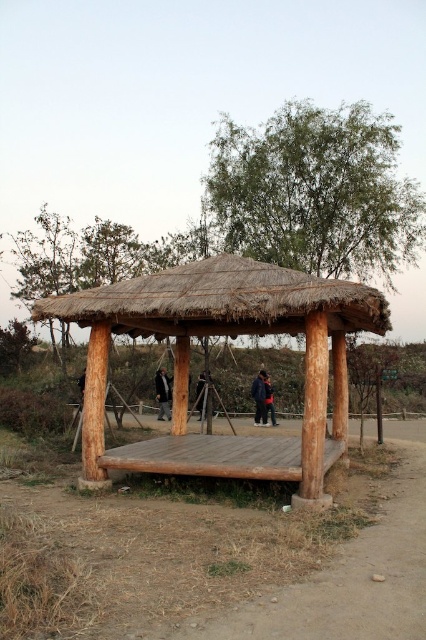
You are standing in the rustic wooden pavilion and want to take a photo of the thatched straw roof at center and the dark blue jeans at center. Which object should you focus on first to ensure both are in focus?

You should focus on the thatched straw roof at center first because it is closer to the viewer than the dark blue jeans at center, so adjusting focus from near to far will help both be in focus.

You are standing at the entrance of the rustic wooden pavilion and notice a dark brown leather jacket at center. If you want to pick it up, in which direction should you move relative to your current position?

The dark brown leather jacket at center is located at point 0.616 on the x axis and 0.383 on the y axis, so you should move towards the center of the pavilion to reach it.

You are standing in front of the rustic wooden pavilion and notice two items at the center platform. Which item is shorter between the dark brown leather jacket at center and the dark blue jeans at center?

The dark brown leather jacket at center is shorter than the dark blue jeans at center.